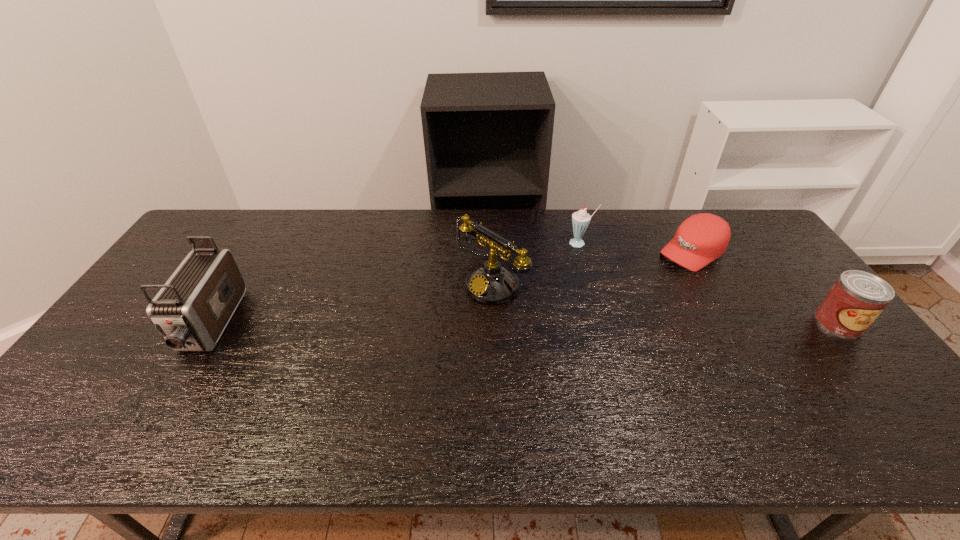
The height and width of the screenshot is (540, 960). In order to click on vacant spot on the desktop that is between the leftmost object and the can and is positioned on the straw side of the milkshake in this screenshot , I will do `click(475, 324)`.

Identify the location of vacant space on the desktop that is between the leftmost object and the can and is positioned on the front-facing side of the shortest object. The width and height of the screenshot is (960, 540). (582, 324).

Identify the location of free space on the desktop that is between the leftmost object and the rightmost object and is positioned on the dial of the fourth object from right to left. (431, 325).